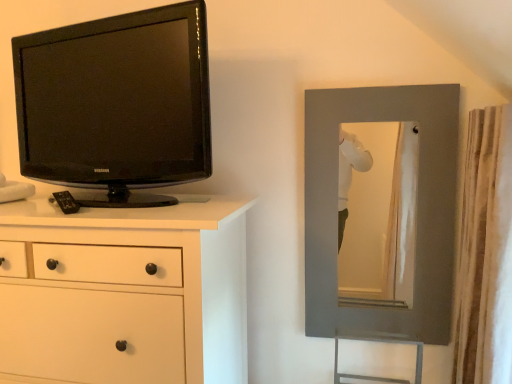
Question: Are matte gray mirror at right and white textured curtain at right far apart?

Choices:
 (A) yes
 (B) no

Answer: (B)

Question: Considering the relative sizes of matte gray mirror at right and white textured curtain at right in the image provided, is matte gray mirror at right shorter than white textured curtain at right?

Choices:
 (A) no
 (B) yes

Answer: (B)

Question: From the image's perspective, is matte gray mirror at right on top of white textured curtain at right?

Choices:
 (A) yes
 (B) no

Answer: (A)

Question: Considering the relative sizes of matte gray mirror at right and white textured curtain at right in the image provided, is matte gray mirror at right taller than white textured curtain at right?

Choices:
 (A) yes
 (B) no

Answer: (B)

Question: Does matte gray mirror at right lie behind white textured curtain at right?

Choices:
 (A) no
 (B) yes

Answer: (B)

Question: From a real-world perspective, is matte gray mirror at right above or below white matte chest of drawers at left?

Choices:
 (A) below
 (B) above

Answer: (B)

Question: Considering the positions of matte gray mirror at right and white matte chest of drawers at left in the image, is matte gray mirror at right taller or shorter than white matte chest of drawers at left?

Choices:
 (A) tall
 (B) short

Answer: (A)

Question: Considering the positions of matte gray mirror at right and white matte chest of drawers at left in the image, is matte gray mirror at right wider or thinner than white matte chest of drawers at left?

Choices:
 (A) thin
 (B) wide

Answer: (A)

Question: Considering the positions of matte gray mirror at right and white matte chest of drawers at left in the image, is matte gray mirror at right bigger or smaller than white matte chest of drawers at left?

Choices:
 (A) big
 (B) small

Answer: (B)

Question: Does point (425, 223) appear closer or farther from the camera than point (462, 291)?

Choices:
 (A) farther
 (B) closer

Answer: (A)

Question: In terms of size, does matte gray mirror at right appear bigger or smaller than white textured curtain at right?

Choices:
 (A) small
 (B) big

Answer: (A)

Question: Is matte gray mirror at right wider or thinner than white textured curtain at right?

Choices:
 (A) wide
 (B) thin

Answer: (B)

Question: Is matte gray mirror at right taller or shorter than white textured curtain at right?

Choices:
 (A) short
 (B) tall

Answer: (A)

Question: Does point (89, 104) appear closer or farther from the camera than point (335, 210)?

Choices:
 (A) farther
 (B) closer

Answer: (B)

Question: Would you say black glossy tv at left is inside or outside matte gray mirror at right?

Choices:
 (A) inside
 (B) outside

Answer: (B)